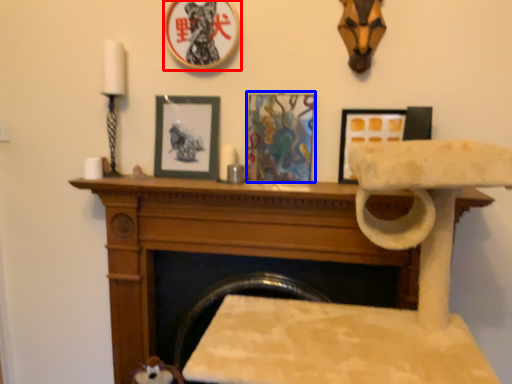
Question: Among these objects, which one is nearest to the camera, picture frame (highlighted by a red box) or picture frame (highlighted by a blue box)?

Choices:
 (A) picture frame
 (B) picture frame

Answer: (A)